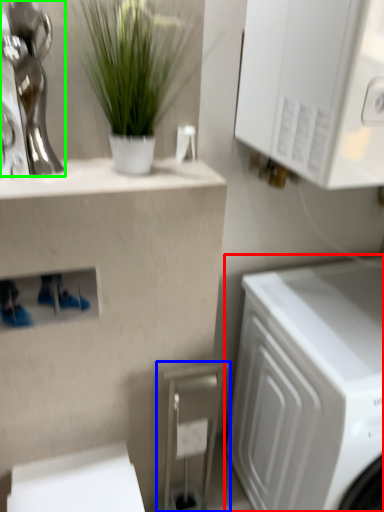
Question: Which is farther away from washing machine (highlighted by a red box)? appliance (highlighted by a blue box) or statue (highlighted by a green box)?

Choices:
 (A) appliance
 (B) statue

Answer: (B)